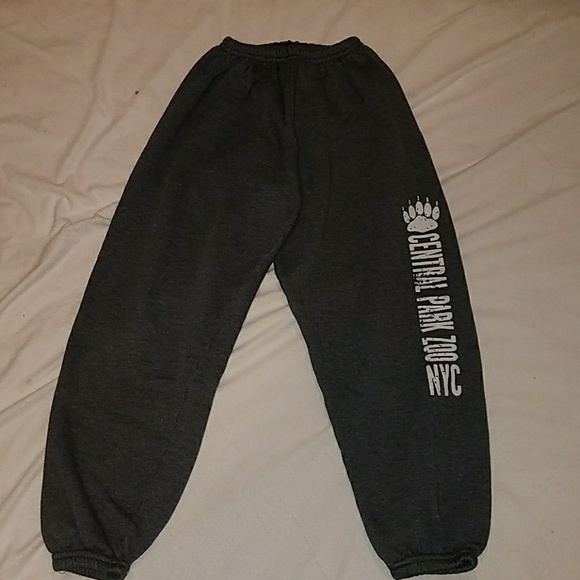
Identify the location of bed sheet. The image size is (580, 580). (39, 299).